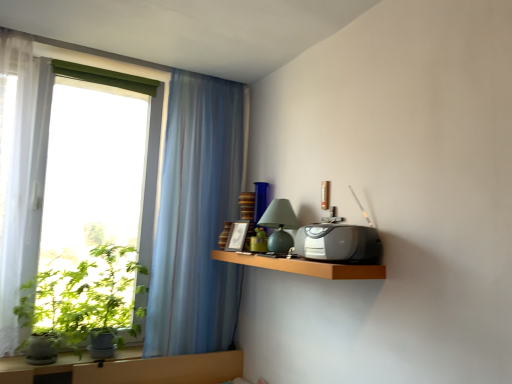
Question: Is the surface of satin black radio at upper right in direct contact with translucent blue curtain at upper left?

Choices:
 (A) no
 (B) yes

Answer: (A)

Question: Is satin black radio at upper right taller than translucent blue curtain at upper left?

Choices:
 (A) yes
 (B) no

Answer: (B)

Question: Considering the relative sizes of satin black radio at upper right and translucent blue curtain at upper left in the image provided, is satin black radio at upper right thinner than translucent blue curtain at upper left?

Choices:
 (A) no
 (B) yes

Answer: (A)

Question: Does satin black radio at upper right lie behind translucent blue curtain at upper left?

Choices:
 (A) yes
 (B) no

Answer: (B)

Question: Is satin black radio at upper right outside of translucent blue curtain at upper left?

Choices:
 (A) no
 (B) yes

Answer: (B)

Question: From the image's perspective, does satin black radio at upper right appear lower than translucent blue curtain at upper left?

Choices:
 (A) no
 (B) yes

Answer: (B)

Question: From the image's perspective, would you say translucent blue curtain at upper left is shown under green leafy plant at left?

Choices:
 (A) yes
 (B) no

Answer: (B)

Question: Is translucent blue curtain at upper left surrounding green leafy plant at left?

Choices:
 (A) yes
 (B) no

Answer: (B)

Question: Can you confirm if translucent blue curtain at upper left is thinner than green leafy plant at left?

Choices:
 (A) no
 (B) yes

Answer: (B)

Question: Can you confirm if translucent blue curtain at upper left is positioned to the right of green leafy plant at left?

Choices:
 (A) yes
 (B) no

Answer: (A)

Question: Does translucent blue curtain at upper left touch green leafy plant at left?

Choices:
 (A) yes
 (B) no

Answer: (B)

Question: From a real-world perspective, does translucent blue curtain at upper left stand above green leafy plant at left?

Choices:
 (A) yes
 (B) no

Answer: (A)

Question: From the image's perspective, is matte green glass table lamp at center below wooden shelf at upper right?

Choices:
 (A) yes
 (B) no

Answer: (B)